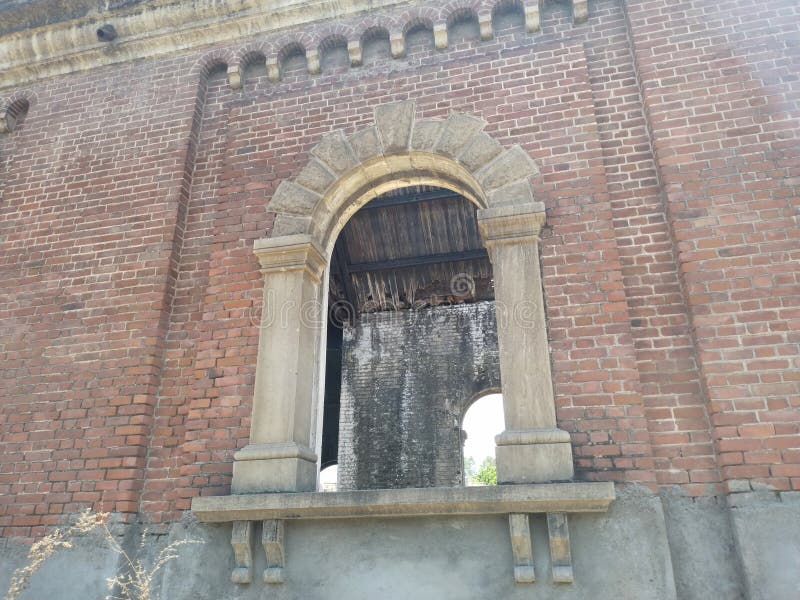
The width and height of the screenshot is (800, 600). Find the location of `frame`. frame is located at coordinates (525, 332).